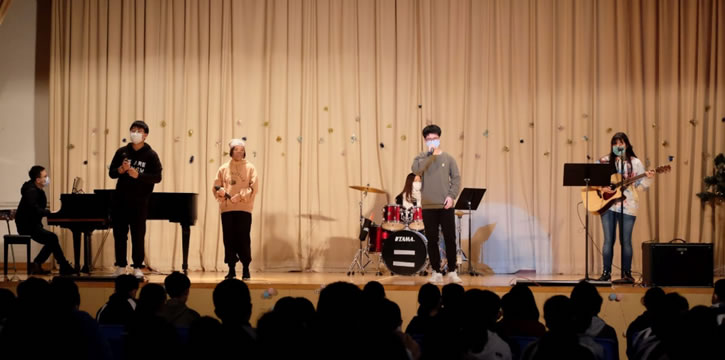
What are the coordinates of `wall` in the screenshot? It's located at (35, 130).